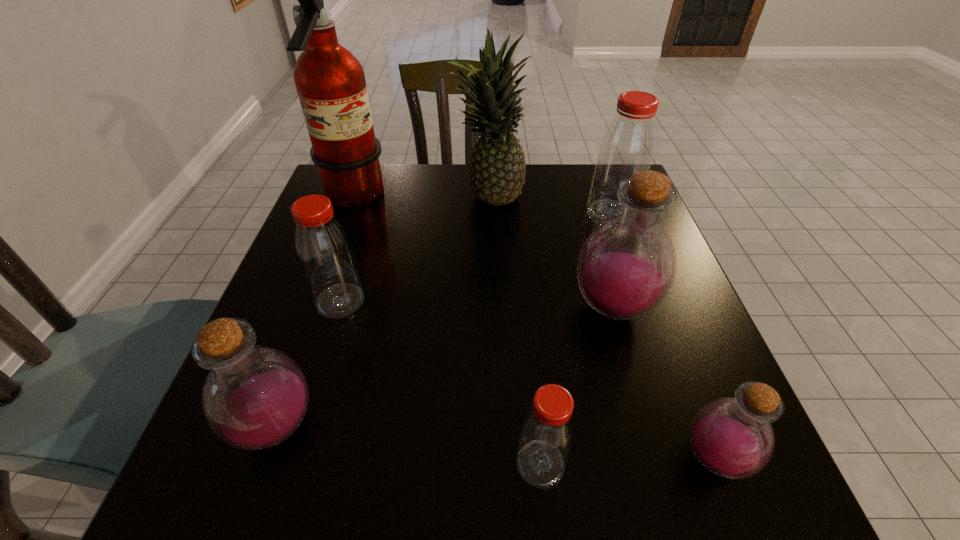
Where is `fire extinguisher positioned at the far edge`? The image size is (960, 540). fire extinguisher positioned at the far edge is located at coordinates (330, 81).

In order to click on pineapple that is at the far edge in this screenshot , I will do `click(497, 172)`.

At what (x,y) coordinates should I click in order to perform the action: click on bottle positioned at the far edge. Please return your answer as a coordinate pair (x, y). This screenshot has height=540, width=960. Looking at the image, I should click on (628, 144).

You are a GUI agent. You are given a task and a screenshot of the screen. Output one action in this format:
    pyautogui.click(x=<x>, y=<y>)
    Task: Click on the fire extinguisher present at the left edge
    Image resolution: width=960 pixels, height=540 pixels.
    Given the screenshot: What is the action you would take?
    pyautogui.click(x=330, y=81)

Find the location of a particular element. object present at the far left corner is located at coordinates (330, 81).

Locate an element on the screen. Image resolution: width=960 pixels, height=540 pixels. object located in the near left corner section of the desktop is located at coordinates (255, 397).

Where is `object present at the far right corner`? This screenshot has width=960, height=540. object present at the far right corner is located at coordinates (628, 144).

Locate an element on the screen. Image resolution: width=960 pixels, height=540 pixels. object that is at the near right corner is located at coordinates (732, 438).

I want to click on free region at the far edge of the desktop, so click(538, 183).

Locate an element on the screen. This screenshot has width=960, height=540. free region at the left edge of the desktop is located at coordinates (311, 436).